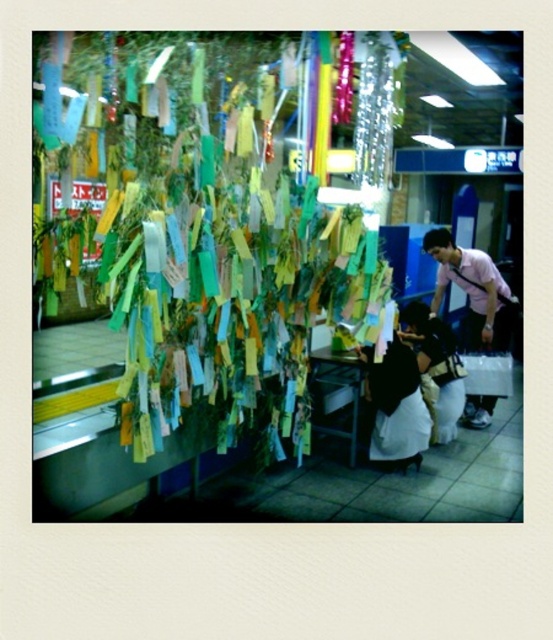
You are organizing a display in a train station and need to know the relative sizes of the objects. Which object is wider, the paper tags at left or the pink cotton shirt at center?

The paper tags at left are wider than the pink cotton shirt at center.

You are an event organizer in the train station and need to check the placement of the paper tags at left and the pink cotton shirt at center. Which object is located lower in the image?

The paper tags at left are located below the pink cotton shirt at center, so the paper tags at left are lower in the image.

From the picture: You are a photographer positioned at the entrance of the train station. You want to take a photo of the pink cotton shirt at center. Based on the coordinates given, where should you aim your camera to capture the shirt in the frame?

The pink cotton shirt at center is located at coordinates point (473, 291), so you should aim your camera at that point to capture the shirt in the frame.